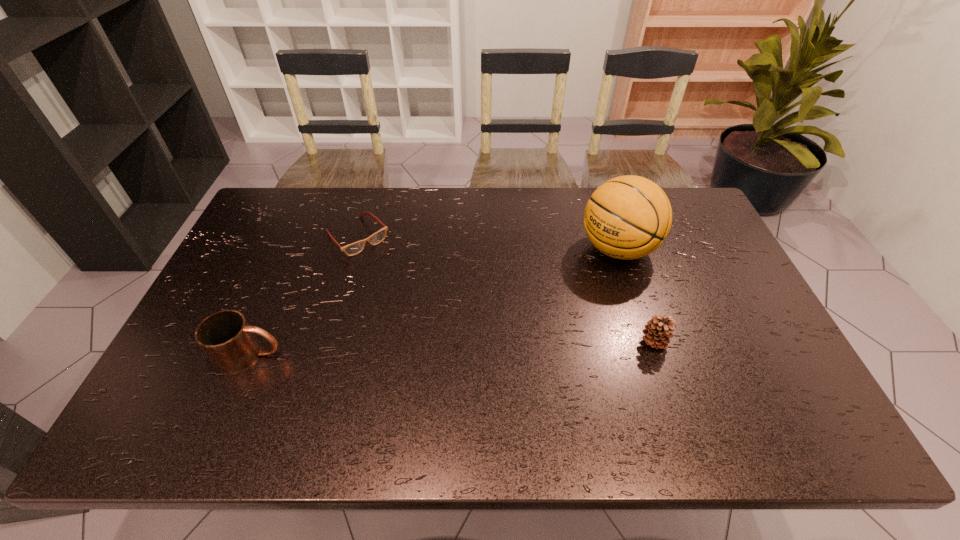
At what (x,y) coordinates should I click in order to perform the action: click on vacant spot on the desktop that is between the mug and the pinecone and is positioned on the front-facing side of the shortest object. Please return your answer as a coordinate pair (x, y). Image resolution: width=960 pixels, height=540 pixels. Looking at the image, I should click on (465, 348).

Locate an element on the screen. The height and width of the screenshot is (540, 960). vacant space on the desktop that is between the mug and the pinecone and is positioned on the surface of the basketball near the brand logo is located at coordinates (467, 348).